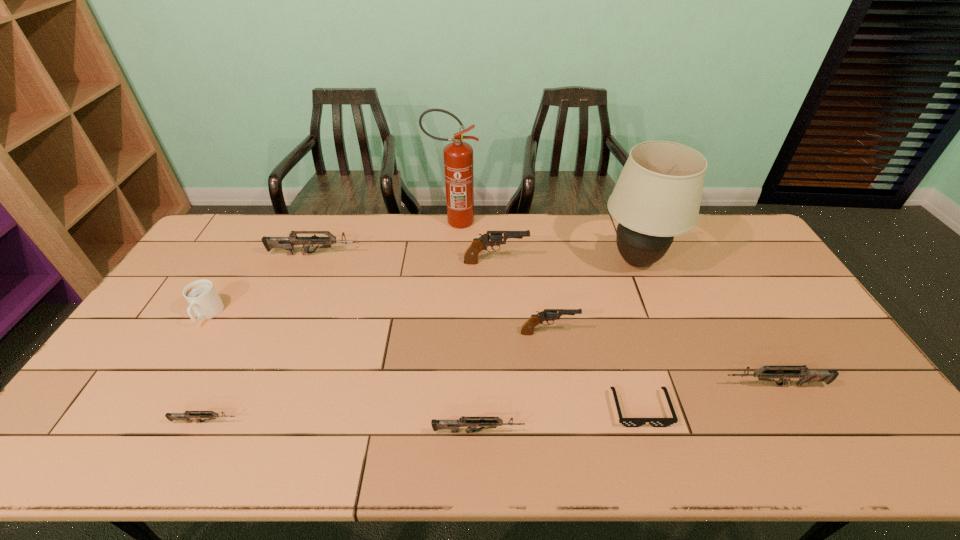
The width and height of the screenshot is (960, 540). I want to click on vacant space located 0.080m on the front-facing side of the black sunglasses, so click(x=656, y=460).

The width and height of the screenshot is (960, 540). Find the location of `fire extinguisher at the far edge`. fire extinguisher at the far edge is located at coordinates (458, 156).

Identify the location of lampshade present at the far edge. (658, 194).

This screenshot has height=540, width=960. I want to click on gun that is at the far edge, so click(x=287, y=243).

This screenshot has width=960, height=540. I want to click on gun at the near edge, so click(x=483, y=422).

The image size is (960, 540). I want to click on sunglasses situated at the near edge, so click(628, 422).

Find the location of `object present at the left edge`. object present at the left edge is located at coordinates (203, 299).

This screenshot has height=540, width=960. Find the location of `object that is at the right edge`. object that is at the right edge is located at coordinates (805, 376).

In the image, there is a desktop. In order to click on free space at the far edge in this screenshot , I will do `click(278, 233)`.

At what (x,y) coordinates should I click in order to perform the action: click on free space at the near edge of the desktop. Please return your answer as a coordinate pair (x, y). The width and height of the screenshot is (960, 540). Looking at the image, I should click on (563, 444).